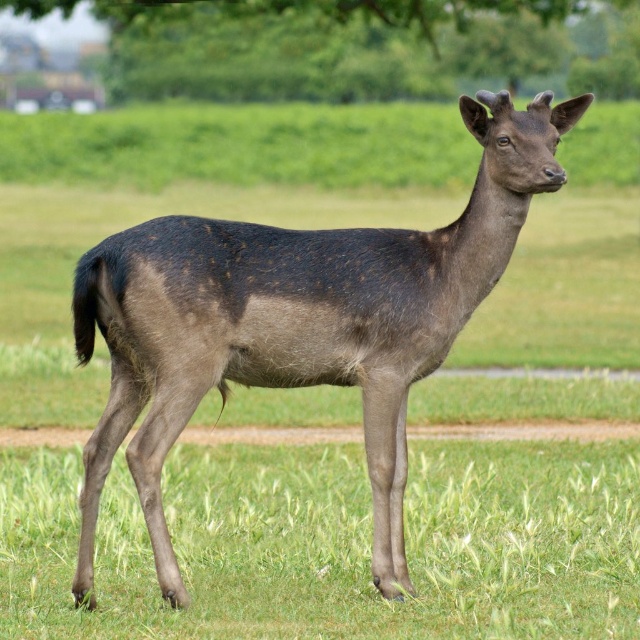
You are a park ranger trying to estimate distances in the field. You see a brown fur deer at center and a green leafy tree at upper center. How far apart are these two objects?

The brown fur deer at center and green leafy tree at upper center are 13.25 meters apart from each other.

You are a wildlife photographer aiming to capture the brown fur deer at center. Based on its position coordinates, where should you position your camera to ensure the deer is centered in your shot?

The brown fur deer at center is located at coordinates point (x=298, y=321), so you should position your camera directly facing that point to center the deer in your shot.

In the scene shown: You are a wildlife photographer aiming to capture the brown fur deer at center and the green leafy tree at upper center in the same frame. Based on their sizes, which object should you focus on first to ensure both fit in the photo?

The brown fur deer at center is larger in width than the green leafy tree at upper center, so you should focus on the brown fur deer at center first to ensure both fit in the photo.